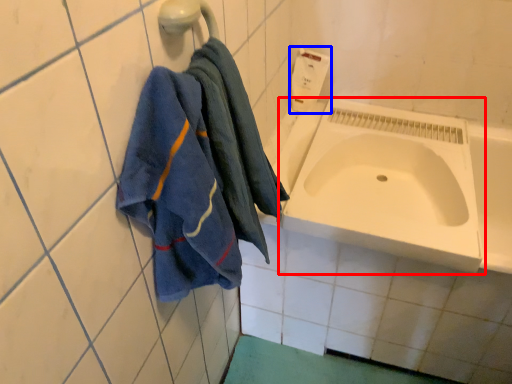
Question: Which object appears farthest to the camera in this image, sink (highlighted by a red box) or soap dispenser (highlighted by a blue box)?

Choices:
 (A) sink
 (B) soap dispenser

Answer: (B)